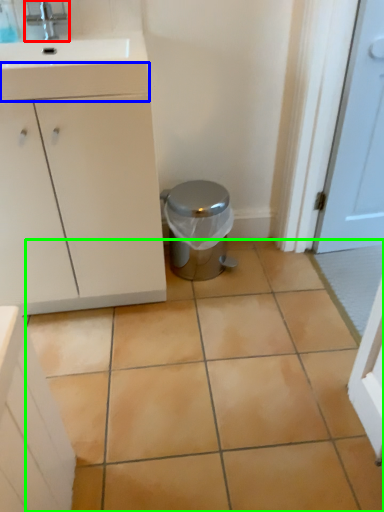
Question: Estimate the real-world distances between objects in this image. Which object is closer to tap (highlighted by a red box), drawer (highlighted by a blue box) or ceramic tile (highlighted by a green box)?

Choices:
 (A) drawer
 (B) ceramic tile

Answer: (A)